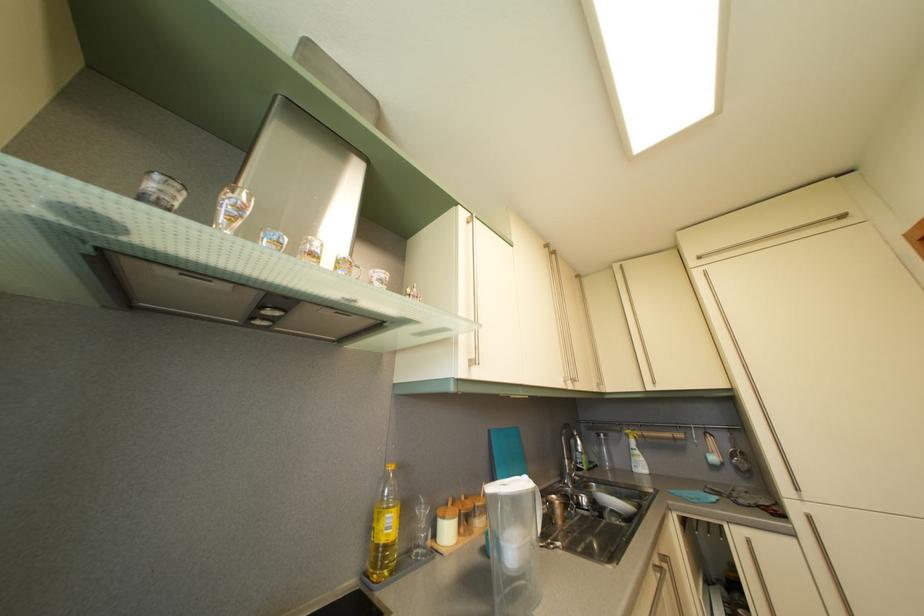
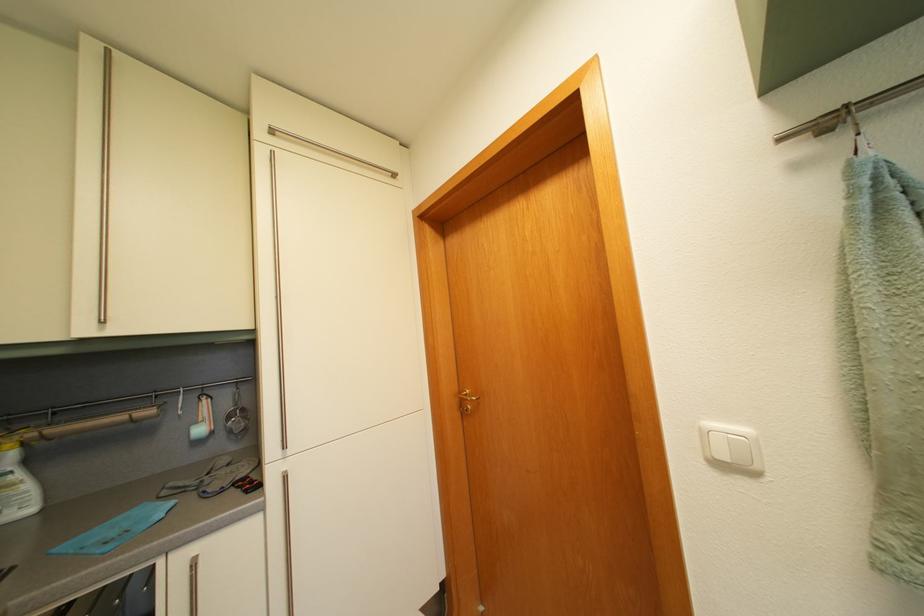
Find the pixel in the second image that matches point (739, 464) in the first image.

(237, 424)